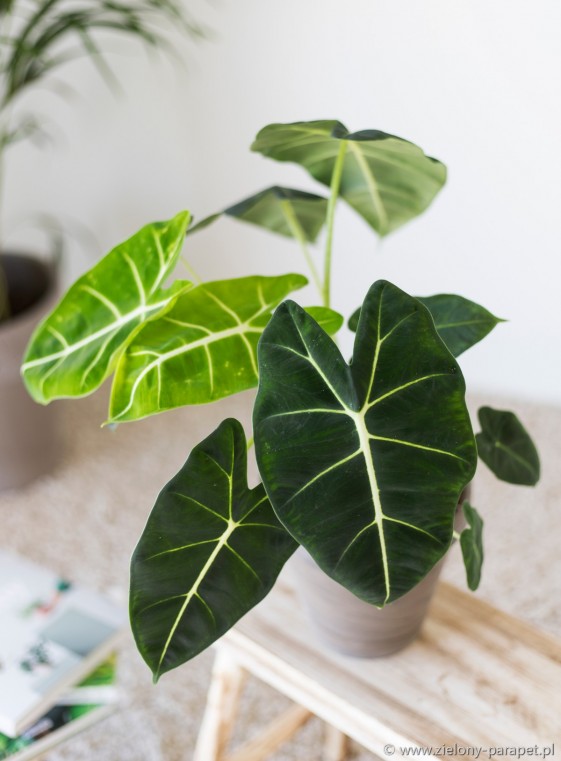
Find the location of a particular element. Image resolution: width=561 pixels, height=761 pixels. stand for bench/table is located at coordinates (220, 724).